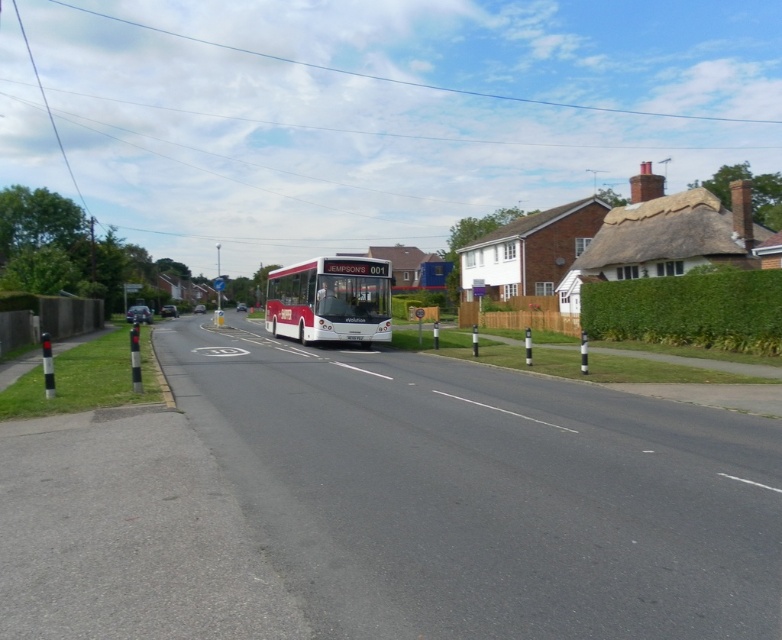
Between green leafy hedge at right and matte red bus at center, which one has less height?

green leafy hedge at right is shorter.

Which is behind, point (626, 285) or point (379, 324)?

Point (626, 285)

At what (x,y) coordinates should I click in order to perform the action: click on green leafy hedge at right. Please return your answer as a coordinate pair (x, y). The width and height of the screenshot is (782, 640). Looking at the image, I should click on (689, 310).

Where is `green leafy hedge at right`? This screenshot has height=640, width=782. green leafy hedge at right is located at coordinates (689, 310).